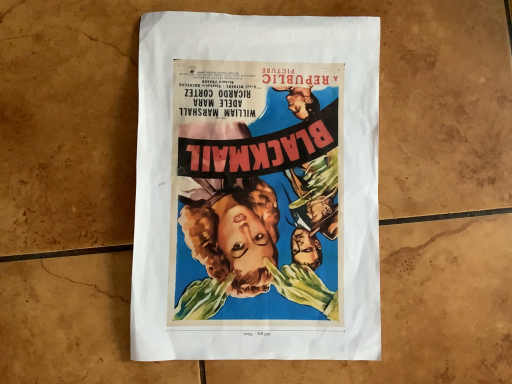
Measure the distance between vibrant paper poster at center and camera.

The depth of vibrant paper poster at center is 14.05 inches.

Measure the distance between point (159, 304) and camera.

A distance of 14.06 inches exists between point (159, 304) and camera.

Image resolution: width=512 pixels, height=384 pixels. What do you see at coordinates (256, 188) in the screenshot?
I see `vibrant paper poster at center` at bounding box center [256, 188].

Identify the location of vibrant paper poster at center. (256, 188).

Locate an element on the screen. The image size is (512, 384). vibrant paper poster at center is located at coordinates (256, 188).